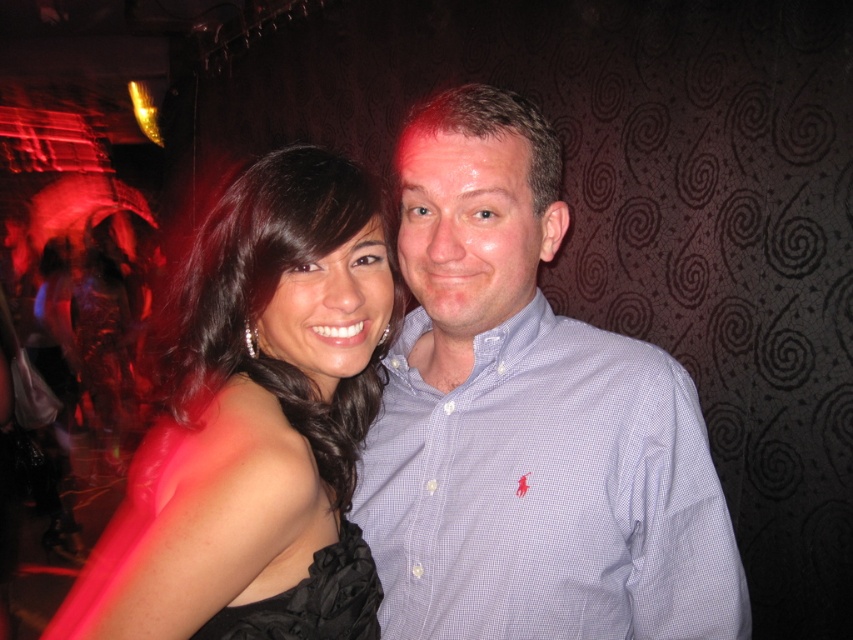
Between blue checkered shirt at center and black satin dress at center, which one appears on the right side from the viewer's perspective?

Positioned to the right is blue checkered shirt at center.

Between blue checkered shirt at center and black satin dress at center, which one has more height?

With more height is blue checkered shirt at center.

Between point (550, 156) and point (294, 220), which one is positioned behind?

Positioned behind is point (550, 156).

Where is `blue checkered shirt at center`? The height and width of the screenshot is (640, 853). blue checkered shirt at center is located at coordinates (527, 420).